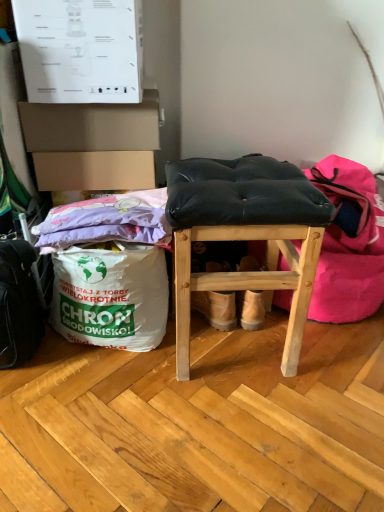
Question: Could you tell me if black leather stool at center is turned towards black fabric bean bag chair at center?

Choices:
 (A) yes
 (B) no

Answer: (B)

Question: Is black leather stool at center positioned before black fabric bean bag chair at center?

Choices:
 (A) yes
 (B) no

Answer: (A)

Question: Does black leather stool at center come behind black fabric bean bag chair at center?

Choices:
 (A) no
 (B) yes

Answer: (A)

Question: Are black leather stool at center and black fabric bean bag chair at center far apart?

Choices:
 (A) yes
 (B) no

Answer: (B)

Question: Is black leather stool at center directly adjacent to black fabric bean bag chair at center?

Choices:
 (A) no
 (B) yes

Answer: (A)

Question: Visually, is cardboard box at upper left positioned to the left or to the right of black fabric bean bag chair at center?

Choices:
 (A) right
 (B) left

Answer: (B)

Question: From a real-world perspective, is cardboard box at upper left positioned above or below black fabric bean bag chair at center?

Choices:
 (A) above
 (B) below

Answer: (A)

Question: From the image's perspective, relative to black fabric bean bag chair at center, is cardboard box at upper left above or below?

Choices:
 (A) above
 (B) below

Answer: (A)

Question: Looking at their shapes, would you say cardboard box at upper left is wider or thinner than black fabric bean bag chair at center?

Choices:
 (A) thin
 (B) wide

Answer: (A)

Question: Considering their positions, is white paper grocery bag at lower left located in front of or behind black leather stool at center?

Choices:
 (A) behind
 (B) front

Answer: (A)

Question: From a real-world perspective, is white paper grocery bag at lower left above or below black leather stool at center?

Choices:
 (A) below
 (B) above

Answer: (A)

Question: Is point (66, 307) closer or farther from the camera than point (266, 193)?

Choices:
 (A) closer
 (B) farther

Answer: (B)

Question: Is white paper grocery bag at lower left taller or shorter than black leather stool at center?

Choices:
 (A) tall
 (B) short

Answer: (B)

Question: From a real-world perspective, is black fabric bean bag chair at center positioned above or below black leather stool at center?

Choices:
 (A) below
 (B) above

Answer: (A)

Question: Considering the positions of point (321, 173) and point (266, 159), is point (321, 173) closer or farther from the camera than point (266, 159)?

Choices:
 (A) farther
 (B) closer

Answer: (A)